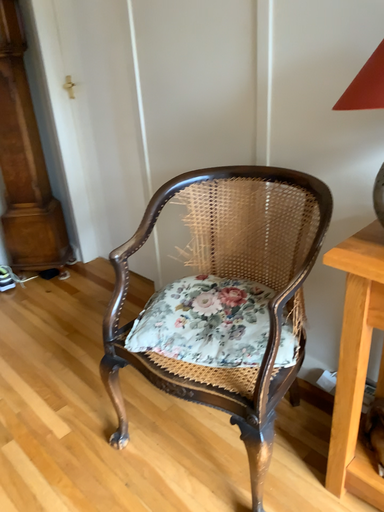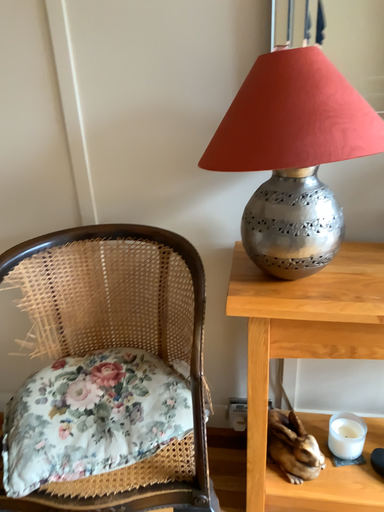
Question: How did the camera likely rotate when shooting the video?

Choices:
 (A) rotated left
 (B) rotated right

Answer: (B)